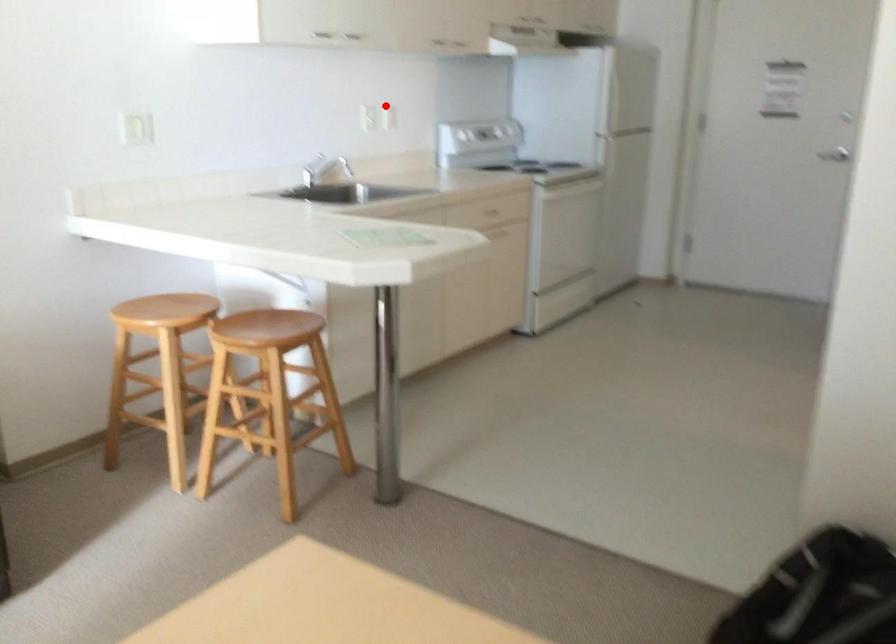
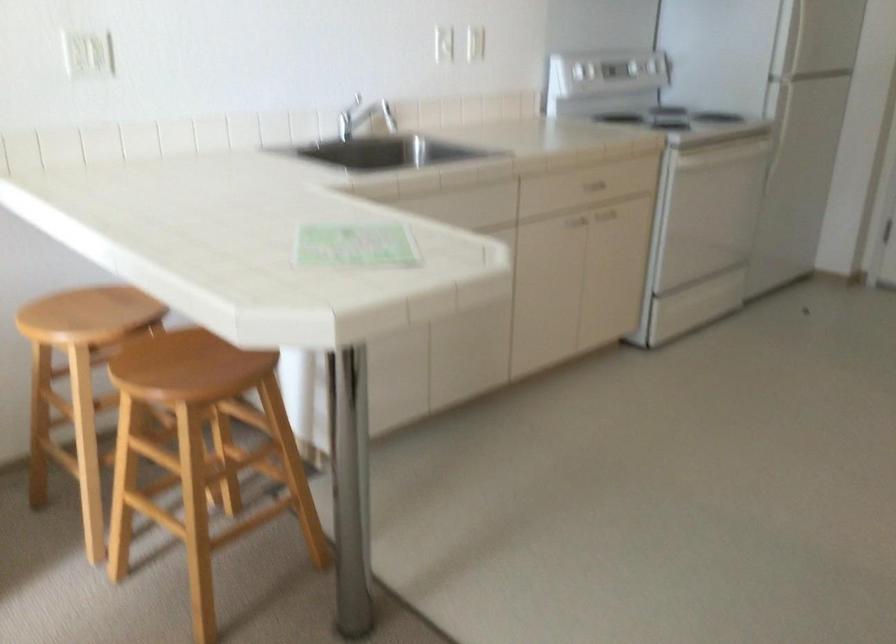
Question: I am providing you with two images of the same scene from different viewpoints. A red point is shown in image1. For the corresponding object point in image2, is it positioned nearer or farther from the camera?

Choices:
 (A) Nearer
 (B) Farther

Answer: (A)